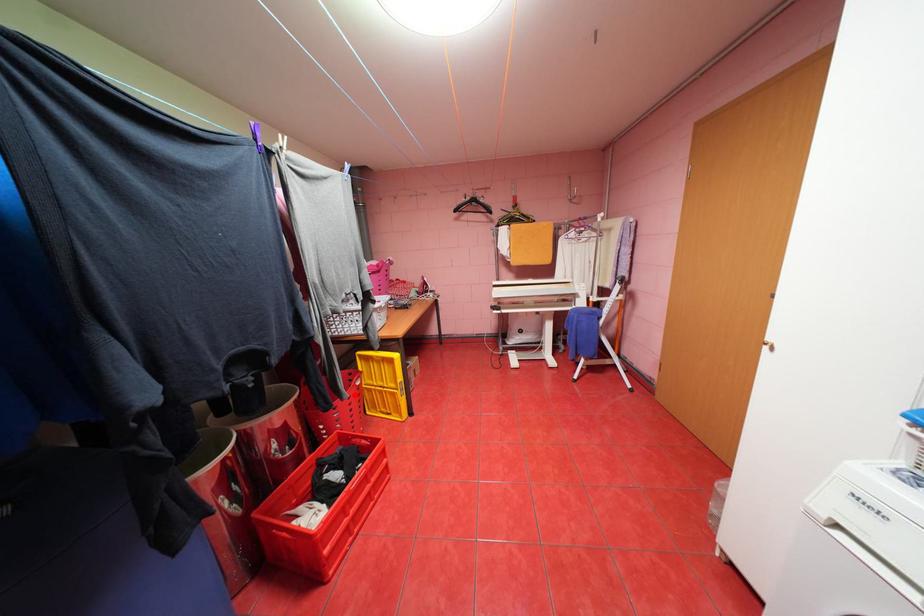
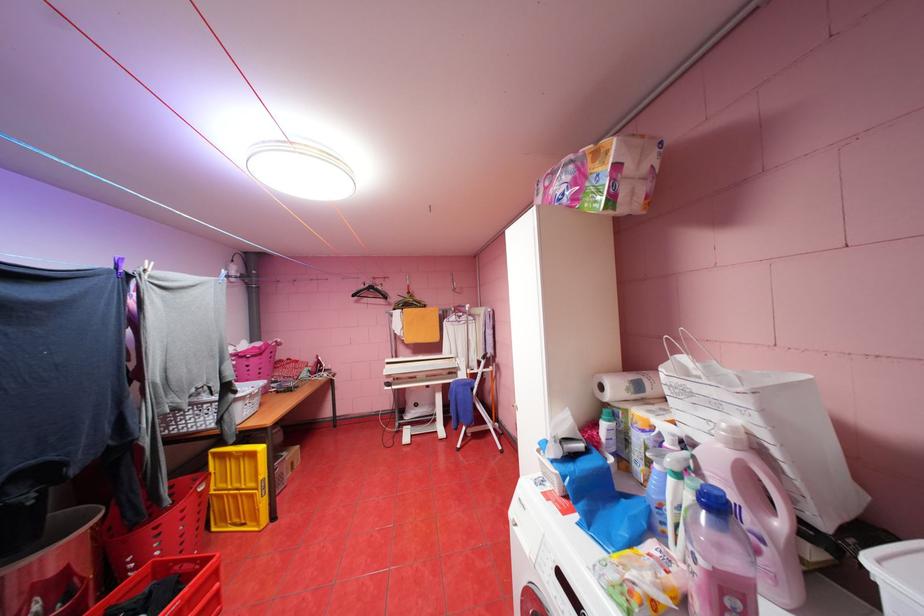
Question: A red point is marked in image1. In image2, is the corresponding 3D point closer to the camera or farther? Reply with the corresponding letter.

Choices:
 (A) The corresponding 3D point is closer.
 (B) The corresponding 3D point is farther.

Answer: (B)